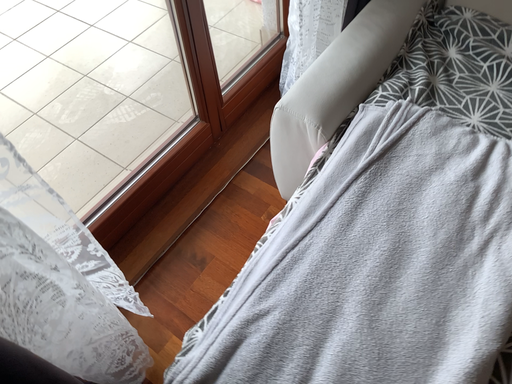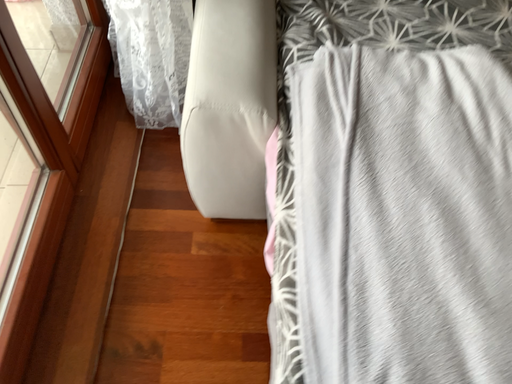
Question: Which way did the camera rotate in the video?

Choices:
 (A) rotated right
 (B) rotated left

Answer: (A)